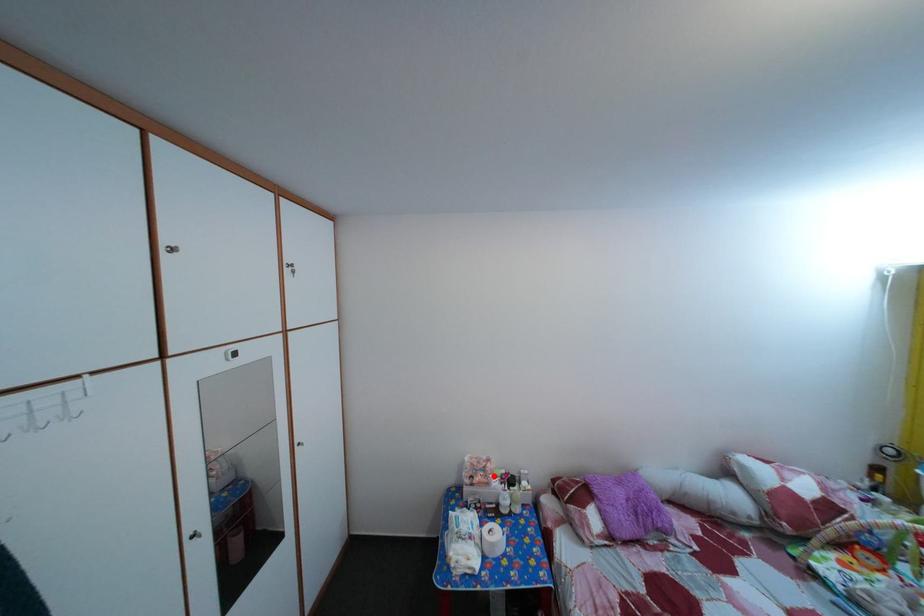
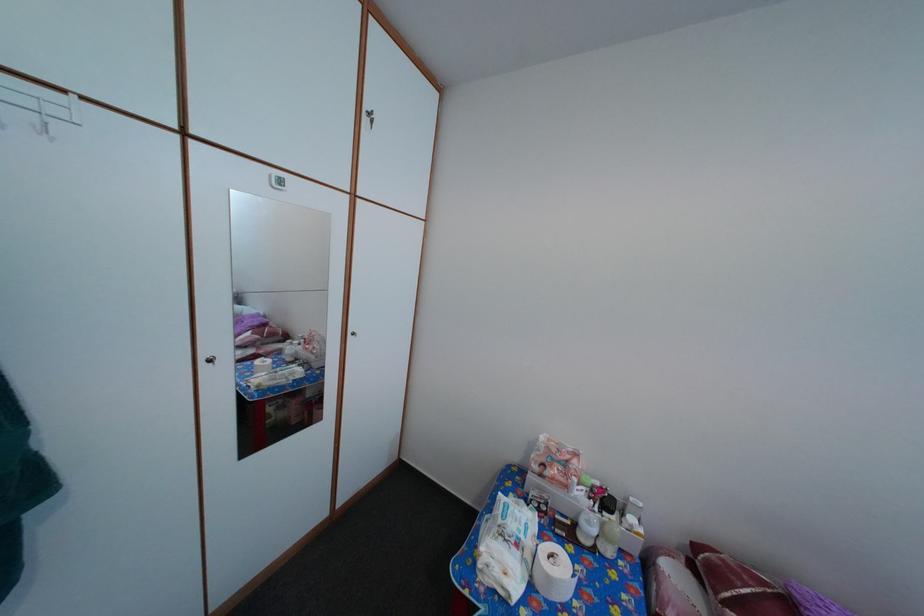
In the second image, find the point that corresponds to the highlighted location in the first image.

(576, 469)